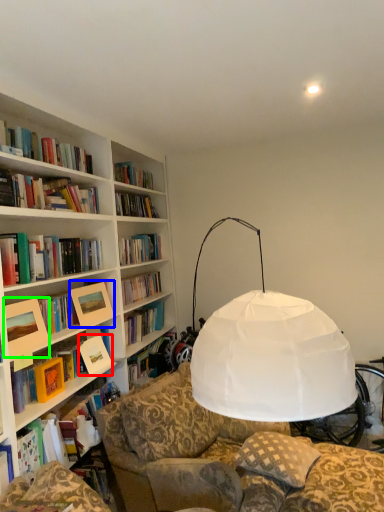
Question: Which object is positioned closest to paperback book (highlighted by a red box)? Select from picture frame (highlighted by a blue box) and picture frame (highlighted by a green box).

Choices:
 (A) picture frame
 (B) picture frame

Answer: (A)